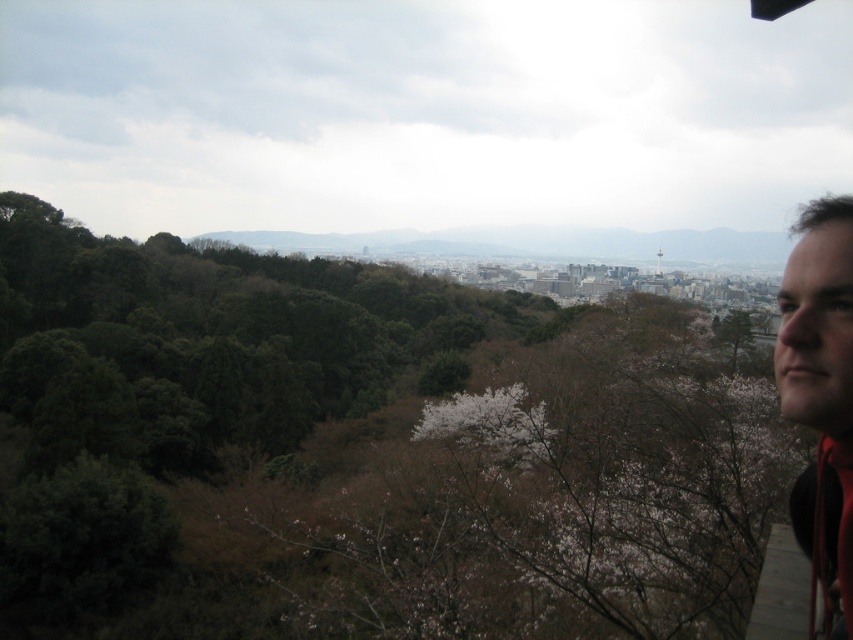
You are an urban planner assessing a proposed drone delivery route. The route must pass between the green matte tree at upper right and the matte black hair at upper right. The minimum safe distance for drones is 500 feet. Can the route be safely established between these two objects?

The green matte tree at upper right is 701.75 feet from the matte black hair at upper right. Since this distance exceeds the minimum safe requirement of 500 feet, the drone delivery route can be safely established between them.